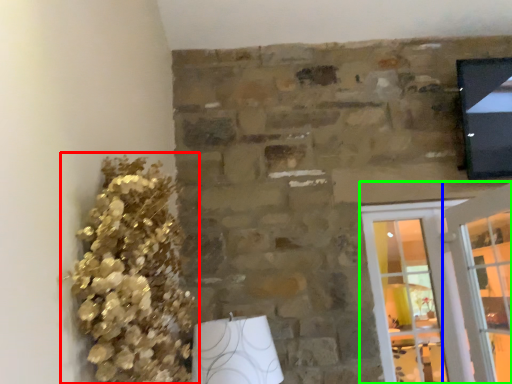
Question: Which is nearer to the floral arrangement (highlighted by a red box)? glass door (highlighted by a blue box) or screen door (highlighted by a green box).

Choices:
 (A) glass door
 (B) screen door

Answer: (B)